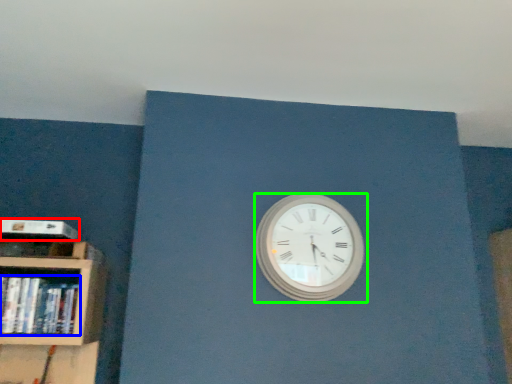
Question: Estimate the real-world distances between objects in this image. Which object is farther from paperback book (highlighted by a red box), book (highlighted by a blue box) or wall clock (highlighted by a green box)?

Choices:
 (A) book
 (B) wall clock

Answer: (B)